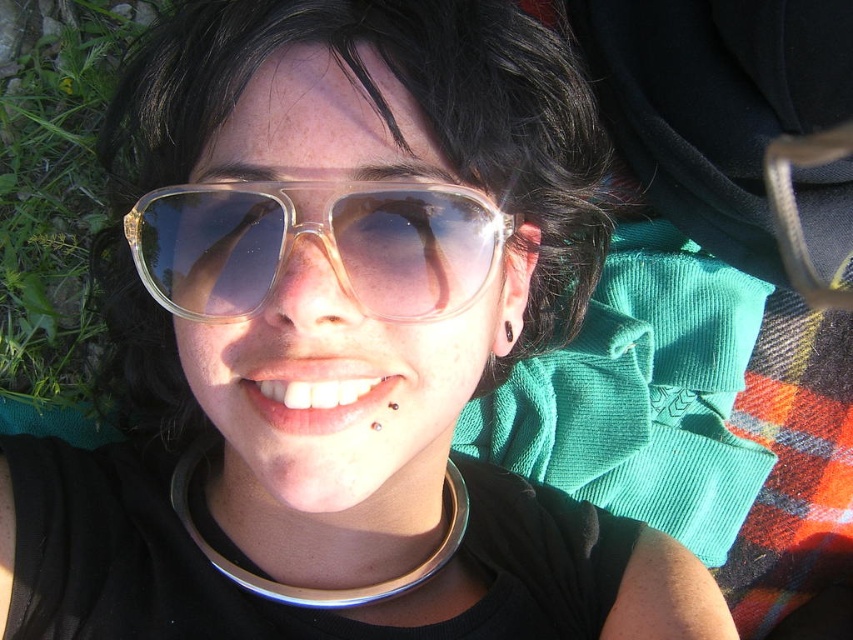
Question: Does transparent plastic goggles at center have a greater width compared to green grass at lower left?

Choices:
 (A) yes
 (B) no

Answer: (A)

Question: Which object appears farthest from the camera in this image?

Choices:
 (A) transparent plastic goggles at center
 (B) green grass at lower left

Answer: (B)

Question: Does transparent plastic goggles at center have a lesser width compared to green grass at lower left?

Choices:
 (A) no
 (B) yes

Answer: (A)

Question: Which point is farther to the camera?

Choices:
 (A) click(x=41, y=16)
 (B) click(x=299, y=225)

Answer: (A)

Question: Does transparent plastic goggles at center appear on the left side of green grass at lower left?

Choices:
 (A) no
 (B) yes

Answer: (A)